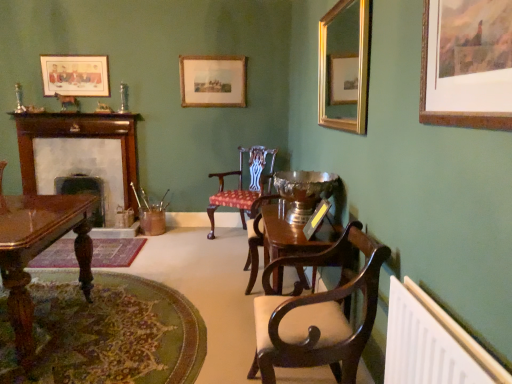
The height and width of the screenshot is (384, 512). What do you see at coordinates (39, 252) in the screenshot? I see `mahogany polished desk at lower left` at bounding box center [39, 252].

The image size is (512, 384). What do you see at coordinates (213, 81) in the screenshot?
I see `wooden picture frame at upper center, acting as the 4th picture frame starting from the front` at bounding box center [213, 81].

This screenshot has width=512, height=384. I want to click on dark wood fireplace at left, the second fireplace from the right, so pos(84,193).

Describe the element at coordinates (318, 313) in the screenshot. I see `mahogany wood chair at center, arranged as the 2th chair when viewed from the back` at that location.

Describe the element at coordinates (242, 185) in the screenshot. I see `mahogany wood chair with upholstered seat at center, which appears as the 1th chair when viewed from the back` at that location.

In order to click on gold-framed mirror at upper right, which ranks as the 3th picture frame in left-to-right order in this screenshot , I will do `click(344, 66)`.

In the image, is matte wooden picture frame at upper left, which ranks as the 3th picture frame in front-to-back order, positioned in front of or behind polished wood armchair at center?

Clearly, matte wooden picture frame at upper left, which ranks as the 3th picture frame in front-to-back order, is behind polished wood armchair at center.

Is matte wooden picture frame at upper left, the second picture frame when ordered from back to front, not inside polished wood armchair at center?

Absolutely, matte wooden picture frame at upper left, the second picture frame when ordered from back to front, is external to polished wood armchair at center.

Are matte wooden picture frame at upper left, the second picture frame when ordered from back to front, and polished wood armchair at center located far from each other?

Yes, matte wooden picture frame at upper left, the second picture frame when ordered from back to front, and polished wood armchair at center are quite far apart.

Measure the distance between gold-framed mirror at upper right, the 2th picture frame from the front, and mahogany polished desk at lower left.

1.84 meters.

Do you think gold-framed mirror at upper right, arranged as the second picture frame when viewed from the right, is within mahogany polished desk at lower left, or outside of it?

gold-framed mirror at upper right, arranged as the second picture frame when viewed from the right, cannot be found inside mahogany polished desk at lower left.

Between gold-framed mirror at upper right, the 2th picture frame from the front, and mahogany polished desk at lower left, which one has less height?

gold-framed mirror at upper right, the 2th picture frame from the front, is shorter.

Is dark wood fireplace at left, the second fireplace from the right, in front of wooden fireplace at left, acting as the 1th fireplace starting from the right?

Yes, dark wood fireplace at left, the second fireplace from the right, is closer to the camera.

Between point (55, 185) and point (38, 182), which one is positioned behind?

The point (55, 185) is farther.

From the image's perspective, relative to wooden fireplace at left, acting as the 1th fireplace starting from the right, is dark wood fireplace at left, the second fireplace from the right, above or below?

Clearly, from the image's perspective, dark wood fireplace at left, the second fireplace from the right, is below wooden fireplace at left, acting as the 1th fireplace starting from the right.

Considering the relative positions of dark wood fireplace at left, the second fireplace from the right, and wooden fireplace at left, acting as the 1th fireplace starting from the right, in the image provided, is dark wood fireplace at left, the second fireplace from the right, to the left or to the right of wooden fireplace at left, acting as the 1th fireplace starting from the right,?

From the image, it's evident that dark wood fireplace at left, the second fireplace from the right, is to the left of wooden fireplace at left, acting as the 1th fireplace starting from the right.

From a real-world perspective, who is located lower, gold-framed mirror at upper right, the 2th picture frame from the front, or gold-framed painting at upper right, which is counted as the first picture frame, starting from the front?

gold-framed painting at upper right, which is counted as the first picture frame, starting from the front, from a real-world perspective.

From the image's perspective, which is above, gold-framed mirror at upper right, the 2th picture frame from the front, or gold-framed painting at upper right, which is counted as the first picture frame, starting from the front?

gold-framed mirror at upper right, the 2th picture frame from the front, is shown above in the image.

How different are the orientations of gold-framed mirror at upper right, the 2th picture frame from the front, and gold-framed painting at upper right, the 4th picture frame viewed from the left, in degrees?

They differ by 0.0244 degrees in their facing directions.

Who is taller, mahogany wood chair with upholstered seat at center, which ranks as the second chair in front-to-back order, or dark wood fireplace at left, the second fireplace from the right?

Standing taller between the two is mahogany wood chair with upholstered seat at center, which ranks as the second chair in front-to-back order.

Locate an element on the screen. The image size is (512, 384). fireplace located underneath the mahogany wood chair with upholstered seat at center, which ranks as the second chair in front-to-back order (from a real-world perspective) is located at coordinates (84, 193).

Does point (212, 209) come closer to viewer compared to point (82, 177)?

That is True.

Which is closer to the camera, [426,105] or [319,85]?

Positioned in front is point [426,105].

From the image's perspective, which object appears higher, gold-framed painting at upper right, which is counted as the first picture frame, starting from the front, or gold-framed mirror at upper right, which ranks as the 3th picture frame in left-to-right order?

gold-framed mirror at upper right, which ranks as the 3th picture frame in left-to-right order, is shown above in the image.

Is gold-framed painting at upper right, the 4th picture frame viewed from the left, not near gold-framed mirror at upper right, which ranks as the 3th picture frame in left-to-right order?

No, gold-framed painting at upper right, the 4th picture frame viewed from the left, is not far from gold-framed mirror at upper right, which ranks as the 3th picture frame in left-to-right order.

Is gold-framed painting at upper right, marked as the 4th picture frame in a back-to-front arrangement, shorter than gold-framed mirror at upper right, the 2th picture frame from the front?

Correct, gold-framed painting at upper right, marked as the 4th picture frame in a back-to-front arrangement, is not as tall as gold-framed mirror at upper right, the 2th picture frame from the front.

From a real-world perspective, is mahogany wood chair at center, arranged as the 2th chair when viewed from the back, positioned above or below polished wood armchair at center?

In terms of real-world spatial position, mahogany wood chair at center, arranged as the 2th chair when viewed from the back, is above polished wood armchair at center.

Considering the sizes of objects mahogany wood chair at center, the first chair positioned from the front, and polished wood armchair at center in the image provided, who is bigger, mahogany wood chair at center, the first chair positioned from the front, or polished wood armchair at center?

Bigger between the two is mahogany wood chair at center, the first chair positioned from the front.

Is point (312, 259) in front of point (259, 234)?

Yes, it is in front of point (259, 234).

Where is `picture frame that is the 2nd one when counting leftward from the polished wood armchair at center`? This screenshot has width=512, height=384. picture frame that is the 2nd one when counting leftward from the polished wood armchair at center is located at coordinates (x=75, y=75).

The height and width of the screenshot is (384, 512). What are the coordinates of `picture frame that is the 2nd object above the mahogany polished desk at lower left (from a real-world perspective)` in the screenshot? It's located at (344, 66).

Looking at the image, which one is located further to wooden picture frame at upper center, the 3th picture frame positioned from the right, matte wooden picture frame at upper left, the 4th picture frame when ordered from right to left, or gold-framed mirror at upper right, arranged as the second picture frame when viewed from the right?

Based on the image, gold-framed mirror at upper right, arranged as the second picture frame when viewed from the right, appears to be further to wooden picture frame at upper center, the 3th picture frame positioned from the right.

Consider the image. Based on their spatial positions, is mahogany wood chair at center, arranged as the 2th chair when viewed from the back, or mahogany wood chair with upholstered seat at center, which appears as the 1th chair when viewed from the back, further from dark wood fireplace at left, arranged as the first fireplace when viewed from the left?

mahogany wood chair at center, arranged as the 2th chair when viewed from the back, lies further to dark wood fireplace at left, arranged as the first fireplace when viewed from the left, than the other object.

Which object lies further to the anchor point mahogany polished desk at lower left, mahogany wood chair at center, arranged as the 2th chair when viewed from the back, or gold-framed painting at upper right, the first picture frame from the right?

gold-framed painting at upper right, the first picture frame from the right, is further to mahogany polished desk at lower left.

Based on their spatial positions, is wooden picture frame at upper center, acting as the 4th picture frame starting from the front, or mahogany wood chair at center, arranged as the 2th chair when viewed from the back, further from polished wood armchair at center?

The object further to polished wood armchair at center is wooden picture frame at upper center, acting as the 4th picture frame starting from the front.

From the image, which object appears to be farther from polished wood armchair at center, mahogany wood chair with upholstered seat at center, which ranks as the second chair in front-to-back order, or wooden picture frame at upper center, the 3th picture frame positioned from the right?

The object further to polished wood armchair at center is wooden picture frame at upper center, the 3th picture frame positioned from the right.

Estimate the real-world distances between objects in this image. Which object is further from dark wood fireplace at left, the second fireplace from the right, white plastic radiator at lower right or mahogany polished desk at lower left?

white plastic radiator at lower right.

When comparing their distances from white plastic radiator at lower right, does gold-framed painting at upper right, which is counted as the first picture frame, starting from the front, or wooden picture frame at upper center, the 1th picture frame from the back, seem further?

Among the two, wooden picture frame at upper center, the 1th picture frame from the back, is located further to white plastic radiator at lower right.

When comparing their distances from mahogany polished desk at lower left, does matte wooden picture frame at upper left, which ranks as the 3th picture frame in front-to-back order, or wooden picture frame at upper center, the 1th picture frame from the back, seem further?

The object further to mahogany polished desk at lower left is wooden picture frame at upper center, the 1th picture frame from the back.

Locate an element on the screen. The width and height of the screenshot is (512, 384). fireplace between dark wood fireplace at left, the second fireplace from the right, and polished wood armchair at center from left to right is located at coordinates (82, 171).

Locate an element on the screen. The width and height of the screenshot is (512, 384). chair positioned between gold-framed painting at upper right, the 4th picture frame viewed from the left, and mahogany wood chair with upholstered seat at center, which appears as the 1th chair when viewed from the back, from near to far is located at coordinates (318, 313).

Identify the location of desk between mahogany wood chair at center, arranged as the 2th chair when viewed from the back, and matte wooden picture frame at upper left, the second picture frame when ordered from back to front, along the z-axis. This screenshot has height=384, width=512. 39,252.

The height and width of the screenshot is (384, 512). I want to click on armchair between mahogany wood chair at center, arranged as the 2th chair when viewed from the back, and wooden picture frame at upper center, the 1th picture frame from the back, in the front-back direction, so click(255, 238).